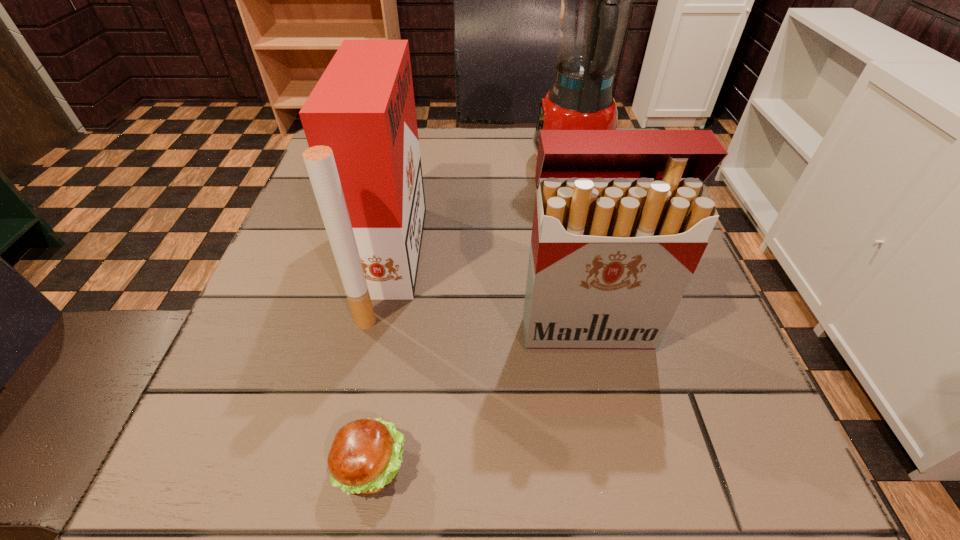
Identify the location of vacant space that satisfies the following two spatial constraints: 1. on the front-facing side of the nearest object; 2. on the left side of the left cigarette case. This screenshot has height=540, width=960. tap(350, 467).

At what (x,y) coordinates should I click in order to perform the action: click on vacant space that satisfies the following two spatial constraints: 1. on the back side of the nearest object; 2. on the front-facing side of the left cigarette case. Please return your answer as a coordinate pair (x, y). This screenshot has width=960, height=540. Looking at the image, I should click on (406, 262).

This screenshot has height=540, width=960. I want to click on free location that satisfies the following two spatial constraints: 1. on the controls of the tallest object; 2. with the lid open on the right cigarette case, so click(612, 329).

The image size is (960, 540). What are the coordinates of `vacant point that satisfies the following two spatial constraints: 1. on the back side of the hamburger; 2. on the front-facing side of the left cigarette case` in the screenshot? It's located at (406, 262).

Locate an element on the screen. This screenshot has height=540, width=960. vacant space that satisfies the following two spatial constraints: 1. on the controls of the tallest object; 2. with the lid open on the right cigarette case is located at coordinates (612, 329).

I want to click on vacant space that satisfies the following two spatial constraints: 1. on the front-facing side of the shortest object; 2. on the right side of the left cigarette case, so click(x=350, y=467).

The width and height of the screenshot is (960, 540). Find the location of `vacant space that satisfies the following two spatial constraints: 1. on the front-facing side of the left cigarette case; 2. on the right side of the hamburger`. vacant space that satisfies the following two spatial constraints: 1. on the front-facing side of the left cigarette case; 2. on the right side of the hamburger is located at coordinates (350, 467).

The width and height of the screenshot is (960, 540). What are the coordinates of `free location that satisfies the following two spatial constraints: 1. on the front-facing side of the left cigarette case; 2. on the left side of the hamburger` in the screenshot? It's located at (350, 467).